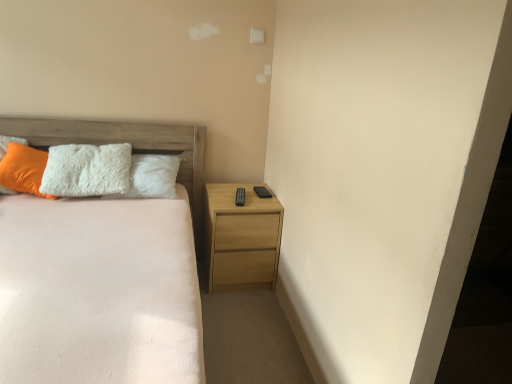
Question: Is wooden headboard at upper left shorter than orange fuzzy pillow at left?

Choices:
 (A) no
 (B) yes

Answer: (A)

Question: Is wooden headboard at upper left positioned before orange fuzzy pillow at left?

Choices:
 (A) yes
 (B) no

Answer: (B)

Question: Could you tell me if wooden headboard at upper left is turned towards orange fuzzy pillow at left?

Choices:
 (A) no
 (B) yes

Answer: (A)

Question: Can you confirm if wooden headboard at upper left is smaller than orange fuzzy pillow at left?

Choices:
 (A) no
 (B) yes

Answer: (A)

Question: From a real-world perspective, is wooden headboard at upper left located higher than orange fuzzy pillow at left?

Choices:
 (A) no
 (B) yes

Answer: (A)

Question: From a real-world perspective, is orange fuzzy pillow at left above or below wooden headboard at upper left?

Choices:
 (A) above
 (B) below

Answer: (A)

Question: Is orange fuzzy pillow at left in front of or behind wooden headboard at upper left in the image?

Choices:
 (A) front
 (B) behind

Answer: (A)

Question: Is orange fuzzy pillow at left to the left or to the right of wooden headboard at upper left in the image?

Choices:
 (A) left
 (B) right

Answer: (A)

Question: Is point (34, 165) closer or farther from the camera than point (195, 182)?

Choices:
 (A) closer
 (B) farther

Answer: (A)

Question: Would you say light wood/texture nightstand at right is inside or outside wooden headboard at upper left?

Choices:
 (A) outside
 (B) inside

Answer: (A)

Question: Considering the positions of light wood/texture nightstand at right and wooden headboard at upper left in the image, is light wood/texture nightstand at right wider or thinner than wooden headboard at upper left?

Choices:
 (A) thin
 (B) wide

Answer: (B)

Question: In terms of size, does light wood/texture nightstand at right appear bigger or smaller than wooden headboard at upper left?

Choices:
 (A) big
 (B) small

Answer: (B)

Question: From the image's perspective, is light wood/texture nightstand at right located above or below wooden headboard at upper left?

Choices:
 (A) above
 (B) below

Answer: (B)

Question: Considering the positions of orange fuzzy pillow at left and white fluffy bed at center in the image, is orange fuzzy pillow at left bigger or smaller than white fluffy bed at center?

Choices:
 (A) small
 (B) big

Answer: (A)

Question: From the image's perspective, is orange fuzzy pillow at left located above or below white fluffy bed at center?

Choices:
 (A) above
 (B) below

Answer: (A)